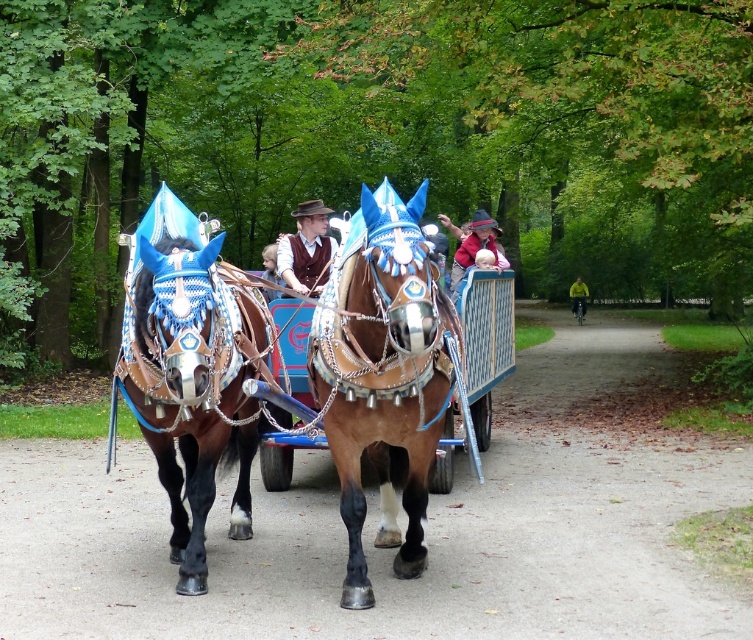
Question: Based on their relative distances, which object is nearer to the brown leather vest at center?

Choices:
 (A) green fabric jacket at center
 (B) shiny metallic cart at center
 (C) matte brown leather jacket at center
 (D) smooth brown vest at center

Answer: (B)

Question: Can you confirm if matte brown leather jacket at center is positioned to the right of green fabric jacket at center?

Choices:
 (A) no
 (B) yes

Answer: (A)

Question: Which point is closer to the camera?

Choices:
 (A) matte brown leather jacket at center
 (B) shiny brown cart at center
 (C) shiny metallic cart at center
 (D) green fabric jacket at center

Answer: (B)

Question: Can you confirm if brown leather harness at center is smaller than matte brown leather jacket at center?

Choices:
 (A) yes
 (B) no

Answer: (B)

Question: In this image, where is shiny brown cart at center located relative to matte brown leather jacket at center?

Choices:
 (A) below
 (B) above

Answer: (A)

Question: Which point appears closest to the camera in this image?

Choices:
 (A) (309, 241)
 (B) (468, 241)
 (C) (291, 452)
 (D) (581, 308)

Answer: (A)